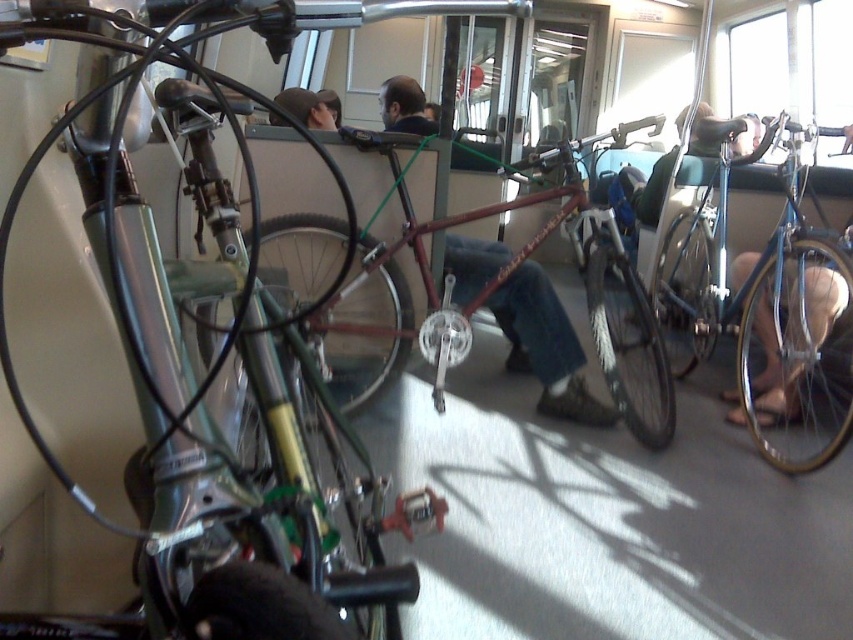
You are standing at the entrance of the public transportation vehicle and see the point marked at coordinates (213, 380). Which object is this point located on?

The point marked at coordinates (213, 380) is located on the shiny metallic bicycle at center.

You are a passenger on a public transport vehicle and need to load your bicycle. You see the shiny metallic bicycle at center and the shiny red bike at center. Which bicycle has a thinner frame?

The shiny metallic bicycle at center is thinner than the shiny red bike at center.

You are a passenger on a public transport vehicle and need to retrieve your shiny metallic bicycle at center and shiny red bike at center. Which bike should you approach first if you want to take the one on the left side?

The shiny metallic bicycle at center is to the left of the shiny red bike at center, so you should approach the shiny metallic bicycle at center first.